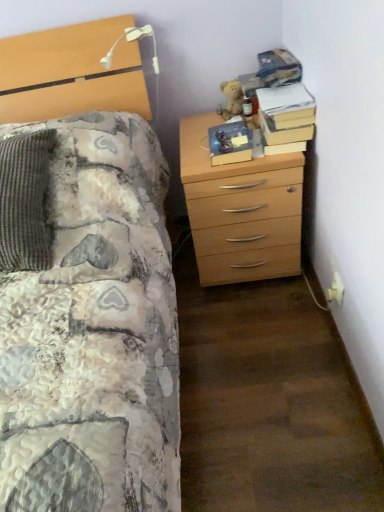
Question: From a real-world perspective, is hardcover book at center, the second book in the right-to-left sequence, above or below hardcover book at upper right, which appears as the first book when viewed from the right?

Choices:
 (A) below
 (B) above

Answer: (A)

Question: Does point (223, 155) appear closer or farther from the camera than point (311, 115)?

Choices:
 (A) closer
 (B) farther

Answer: (B)

Question: Which object is positioned closest to the fuzzy brown teddy bear at upper right?

Choices:
 (A) hardcover book at upper right, positioned as the 2th book in left-to-right order
 (B) hardcover book at center, which is the first book in left-to-right order
 (C) white plastic electric outlet at lower right
 (D) light wood chest of drawers at right

Answer: (B)

Question: Which of these objects is positioned closest to the white plastic electric outlet at lower right?

Choices:
 (A) fuzzy brown teddy bear at upper right
 (B) hardcover book at upper right, which appears as the first book when viewed from the right
 (C) light wood chest of drawers at right
 (D) hardcover book at center, which is the first book in left-to-right order

Answer: (C)